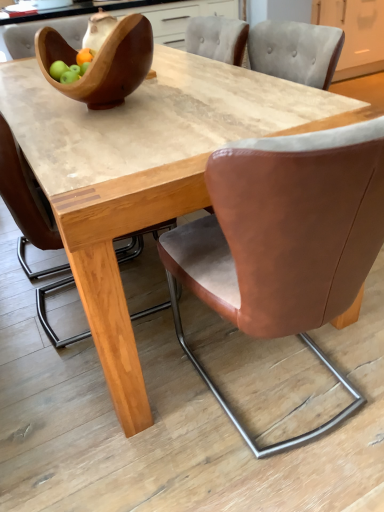
Describe the element at coordinates (354, 33) in the screenshot. The width and height of the screenshot is (384, 512). I see `matte gray cabinet at upper right` at that location.

What is the approximate height of brown leather chair at lower right?

The height of brown leather chair at lower right is 2.37 inches.

Find the location of a particular element. This screenshot has height=512, width=384. brown leather chair at lower right is located at coordinates (167, 420).

What are the coordinates of `brown leather chair at center, the first chair viewed from the right` in the screenshot? It's located at (284, 240).

Find the location of a particular element. The width and height of the screenshot is (384, 512). brown leather chair at center, the second chair from the right is located at coordinates (26, 203).

Does wooden bowl at upper left have a smaller size compared to brown leather chair at center, the first chair viewed from the right?

Correct, wooden bowl at upper left occupies less space than brown leather chair at center, the first chair viewed from the right.

How far apart are wooden bowl at upper left and brown leather chair at center, which ranks as the second chair in left-to-right order?

A distance of 26.88 inches exists between wooden bowl at upper left and brown leather chair at center, which ranks as the second chair in left-to-right order.

Would you consider wooden bowl at upper left to be distant from brown leather chair at center, which ranks as the second chair in left-to-right order?

No, wooden bowl at upper left is in close proximity to brown leather chair at center, which ranks as the second chair in left-to-right order.

Between wooden bowl at upper left and brown leather chair at center, which ranks as the second chair in left-to-right order, which one has larger width?

brown leather chair at center, which ranks as the second chair in left-to-right order.

Can you tell me how much brown leather chair at lower right and brown leather chair at center, which appears as the 1th chair when viewed from the left, differ in facing direction?

The angle between the facing direction of brown leather chair at lower right and the facing direction of brown leather chair at center, which appears as the 1th chair when viewed from the left, is 1.05 degrees.

Is brown leather chair at lower right not near brown leather chair at center, which appears as the 1th chair when viewed from the left?

No, brown leather chair at lower right is not far from brown leather chair at center, which appears as the 1th chair when viewed from the left.

Find the location of `concrete below the brown leather chair at center, the second chair from the right (from a real-world perspective)`. concrete below the brown leather chair at center, the second chair from the right (from a real-world perspective) is located at coordinates (167, 420).

Is point (131, 467) closer or farther from the camera than point (4, 128)?

Point (131, 467).

Can you confirm if matte gray cabinet at upper right is wider than brown leather chair at center, the second chair from the right?

Correct, the width of matte gray cabinet at upper right exceeds that of brown leather chair at center, the second chair from the right.

From a real-world perspective, relative to brown leather chair at center, which appears as the 1th chair when viewed from the left, is matte gray cabinet at upper right vertically above or below?

matte gray cabinet at upper right is below brown leather chair at center, which appears as the 1th chair when viewed from the left.

Measure the distance from matte gray cabinet at upper right to brown leather chair at center, the second chair from the right.

matte gray cabinet at upper right and brown leather chair at center, the second chair from the right, are 3.85 meters apart from each other.

Considering the relative sizes of brown leather chair at center, the first chair viewed from the right, and matte gray cabinet at upper right in the image provided, is brown leather chair at center, the first chair viewed from the right, wider than matte gray cabinet at upper right?

Incorrect, the width of brown leather chair at center, the first chair viewed from the right, does not surpass that of matte gray cabinet at upper right.

Choose the correct answer: Is brown leather chair at center, the first chair viewed from the right, inside matte gray cabinet at upper right or outside it?

brown leather chair at center, the first chair viewed from the right, is outside matte gray cabinet at upper right.

Considering the sizes of objects brown leather chair at center, the first chair viewed from the right, and matte gray cabinet at upper right in the image provided, who is smaller, brown leather chair at center, the first chair viewed from the right, or matte gray cabinet at upper right?

Smaller between the two is brown leather chair at center, the first chair viewed from the right.

Is brown leather chair at center, the first chair viewed from the right, positioned with its back to matte gray cabinet at upper right?

brown leather chair at center, the first chair viewed from the right, does not have its back to matte gray cabinet at upper right.

From a real-world perspective, is matte gray cabinet at upper right positioned above or below brown leather chair at center, the first chair viewed from the right?

matte gray cabinet at upper right is below brown leather chair at center, the first chair viewed from the right.

The width and height of the screenshot is (384, 512). In order to click on the 1st chair positioned above the matte gray cabinet at upper right (from a real-world perspective) in this screenshot , I will do `click(284, 240)`.

Considering the relative sizes of matte gray cabinet at upper right and brown leather chair at center, the first chair viewed from the right, in the image provided, is matte gray cabinet at upper right smaller than brown leather chair at center, the first chair viewed from the right,?

No, matte gray cabinet at upper right is not smaller than brown leather chair at center, the first chair viewed from the right.

Which is correct: matte gray cabinet at upper right is inside brown leather chair at center, the first chair viewed from the right, or outside of it?

matte gray cabinet at upper right is located beyond the bounds of brown leather chair at center, the first chair viewed from the right.

Does brown leather chair at center, which ranks as the second chair in left-to-right order, have a lesser height compared to wooden bowl at upper left?

No, brown leather chair at center, which ranks as the second chair in left-to-right order, is not shorter than wooden bowl at upper left.

From a real-world perspective, which is physically below, brown leather chair at center, the first chair viewed from the right, or wooden bowl at upper left?

From a 3D spatial view, brown leather chair at center, the first chair viewed from the right, is below.

From the image's perspective, is brown leather chair at center, which ranks as the second chair in left-to-right order, above or below wooden bowl at upper left?

brown leather chair at center, which ranks as the second chair in left-to-right order, is below wooden bowl at upper left.

Considering the positions of objects brown leather chair at lower right and matte gray cabinet at upper right in the image provided, who is behind, brown leather chair at lower right or matte gray cabinet at upper right?

matte gray cabinet at upper right.

Which object is positioned more to the right, brown leather chair at lower right or matte gray cabinet at upper right?

matte gray cabinet at upper right is more to the right.

Is brown leather chair at lower right bigger or smaller than matte gray cabinet at upper right?

Considering their sizes, brown leather chair at lower right takes up less space than matte gray cabinet at upper right.

Between point (135, 494) and point (348, 33), which one is positioned in front?

The point (135, 494) is closer to the camera.

The height and width of the screenshot is (512, 384). I want to click on bowl lying behind the brown leather chair at center, which ranks as the second chair in left-to-right order, so click(102, 62).

This screenshot has height=512, width=384. I want to click on concrete below the brown leather chair at center, the second chair from the right (from a real-world perspective), so click(167, 420).

Which object lies nearer to the anchor point matte gray cabinet at upper right, brown leather chair at center, which appears as the 1th chair when viewed from the left, or brown leather chair at center, which ranks as the second chair in left-to-right order?

brown leather chair at center, which ranks as the second chair in left-to-right order, lies closer to matte gray cabinet at upper right than the other object.

Which object lies further to the anchor point matte gray cabinet at upper right, brown leather chair at center, the second chair from the right, or brown leather chair at lower right?

Among the two, brown leather chair at center, the second chair from the right, is located further to matte gray cabinet at upper right.

Which object lies further to the anchor point brown leather chair at center, the first chair viewed from the right, wooden bowl at upper left or brown leather chair at lower right?

Based on the image, wooden bowl at upper left appears to be further to brown leather chair at center, the first chair viewed from the right.

In the scene shown: Estimate the real-world distances between objects in this image. Which object is closer to brown leather chair at lower right, brown leather chair at center, which ranks as the second chair in left-to-right order, or wooden bowl at upper left?

brown leather chair at center, which ranks as the second chair in left-to-right order, is positioned closer to the anchor brown leather chair at lower right.

Which object lies nearer to the anchor point brown leather chair at center, which appears as the 1th chair when viewed from the left, matte gray cabinet at upper right or brown leather chair at lower right?

The object closer to brown leather chair at center, which appears as the 1th chair when viewed from the left, is brown leather chair at lower right.

From the image, which object appears to be nearer to brown leather chair at center, the second chair from the right, brown leather chair at lower right or brown leather chair at center, which ranks as the second chair in left-to-right order?

brown leather chair at center, which ranks as the second chair in left-to-right order.

From the picture: Which object lies nearer to the anchor point matte gray cabinet at upper right, brown leather chair at lower right or wooden bowl at upper left?

wooden bowl at upper left is positioned closer to the anchor matte gray cabinet at upper right.

Estimate the real-world distances between objects in this image. Which object is further from brown leather chair at center, which ranks as the second chair in left-to-right order, brown leather chair at lower right or wooden bowl at upper left?

Based on the image, wooden bowl at upper left appears to be further to brown leather chair at center, which ranks as the second chair in left-to-right order.

The width and height of the screenshot is (384, 512). Find the location of `chair between brown leather chair at center, the first chair viewed from the right, and matte gray cabinet at upper right from front to back`. chair between brown leather chair at center, the first chair viewed from the right, and matte gray cabinet at upper right from front to back is located at coordinates (26, 203).

The width and height of the screenshot is (384, 512). I want to click on bowl between brown leather chair at center, the second chair from the right, and matte gray cabinet at upper right in the front-back direction, so click(x=102, y=62).

Where is `bowl located between brown leather chair at center, which ranks as the second chair in left-to-right order, and matte gray cabinet at upper right in the depth direction`? The height and width of the screenshot is (512, 384). bowl located between brown leather chair at center, which ranks as the second chair in left-to-right order, and matte gray cabinet at upper right in the depth direction is located at coordinates (102, 62).

Where is `bowl situated between brown leather chair at center, the second chair from the right, and brown leather chair at center, the first chair viewed from the right, from left to right`? The height and width of the screenshot is (512, 384). bowl situated between brown leather chair at center, the second chair from the right, and brown leather chair at center, the first chair viewed from the right, from left to right is located at coordinates (x=102, y=62).